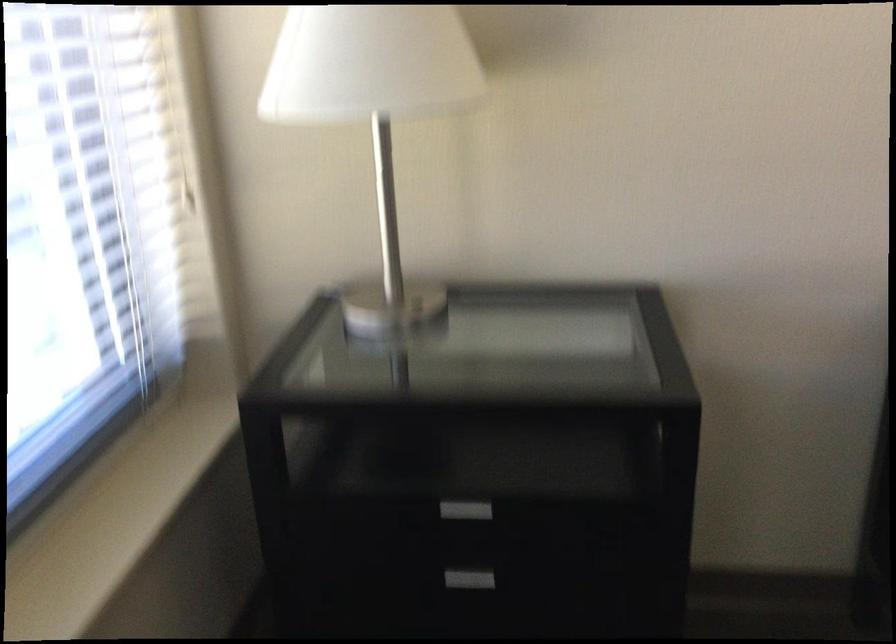
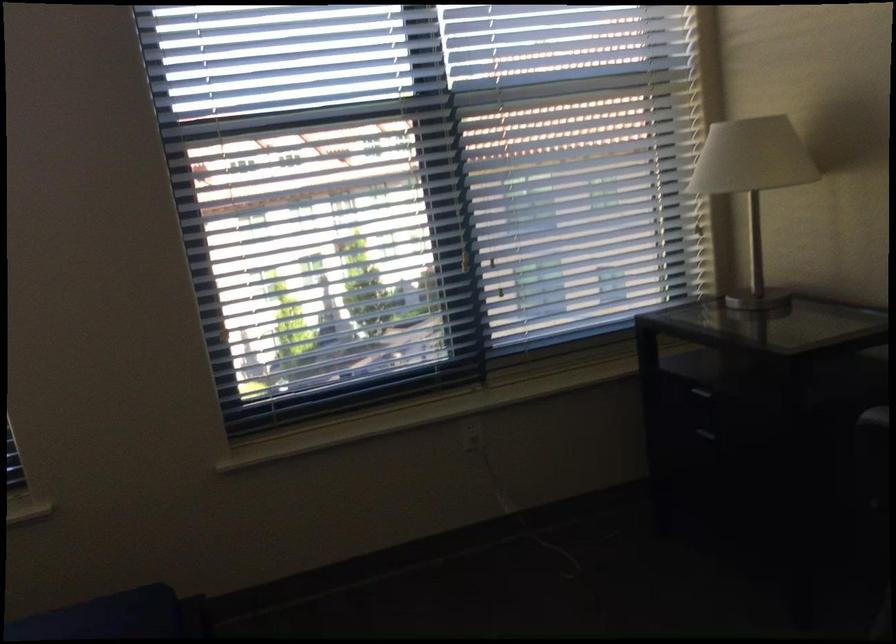
In the second image, find the point that corresponds to [438,107] in the first image.

(753, 184)